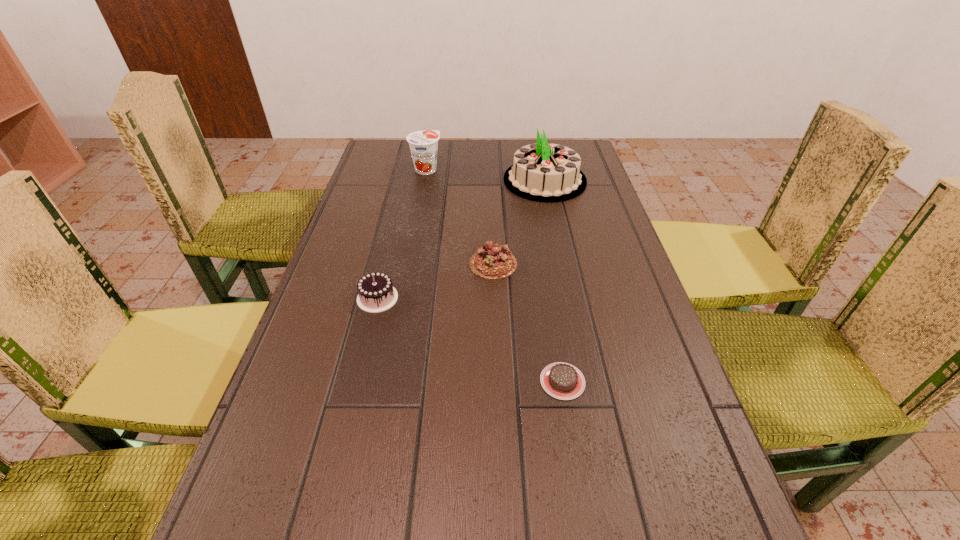
The width and height of the screenshot is (960, 540). I want to click on empty space that is in between the shortest chocolate cake and the birthday cake, so click(x=554, y=281).

Locate an element on the screen. The image size is (960, 540). unoccupied position between the birthday cake and the yogurt is located at coordinates (486, 175).

Where is `empty location between the shortest object and the birthday cake`? This screenshot has height=540, width=960. empty location between the shortest object and the birthday cake is located at coordinates (554, 281).

What are the coordinates of `object that is the closest one to the nearest object` in the screenshot? It's located at (493, 261).

Select which object appears as the closest to the yogurt. Please provide its 2D coordinates. Your answer should be formatted as a tuple, i.e. [(x, y)], where the tuple contains the x and y coordinates of a point satisfying the conditions above.

[(543, 172)]

The width and height of the screenshot is (960, 540). In order to click on chocolate cake identified as the closest to the fourth farthest object in this screenshot , I will do `click(493, 261)`.

Select which chocolate cake is the second closest to the leftmost chocolate cake. Please provide its 2D coordinates. Your answer should be formatted as a tuple, i.e. [(x, y)], where the tuple contains the x and y coordinates of a point satisfying the conditions above.

[(564, 381)]

The width and height of the screenshot is (960, 540). In order to click on vacant space that satisfies the following two spatial constraints: 1. on the back side of the tallest object; 2. on the left side of the second tallest chocolate cake in this screenshot , I will do `click(491, 180)`.

At what (x,y) coordinates should I click in order to perform the action: click on free space that satisfies the following two spatial constraints: 1. on the front side of the fourth farthest object; 2. on the right side of the rightmost chocolate cake. Please return your answer as a coordinate pair (x, y). Looking at the image, I should click on (357, 381).

Identify the location of vacant position in the image that satisfies the following two spatial constraints: 1. on the front side of the fourth shortest object; 2. on the left side of the second shortest chocolate cake. The width and height of the screenshot is (960, 540). (408, 264).